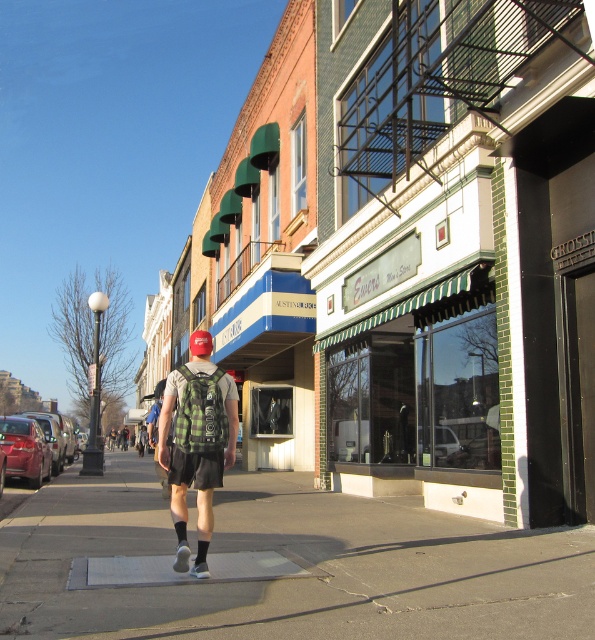
Question: Which object appears farthest from the camera in this image?

Choices:
 (A) gray concrete sidewalk at center
 (B) green plaid backpack at center

Answer: (B)

Question: Which of the following is the farthest from the observer?

Choices:
 (A) green plaid backpack at center
 (B) gray concrete sidewalk at center

Answer: (A)

Question: Which point is farther to the camera?

Choices:
 (A) (64, 476)
 (B) (201, 401)

Answer: (A)

Question: Can you confirm if gray concrete sidewalk at center is bigger than green plaid backpack at center?

Choices:
 (A) yes
 (B) no

Answer: (A)

Question: Can you confirm if gray concrete sidewalk at center is positioned above green plaid backpack at center?

Choices:
 (A) no
 (B) yes

Answer: (A)

Question: Is gray concrete sidewalk at center thinner than green plaid backpack at center?

Choices:
 (A) yes
 (B) no

Answer: (B)